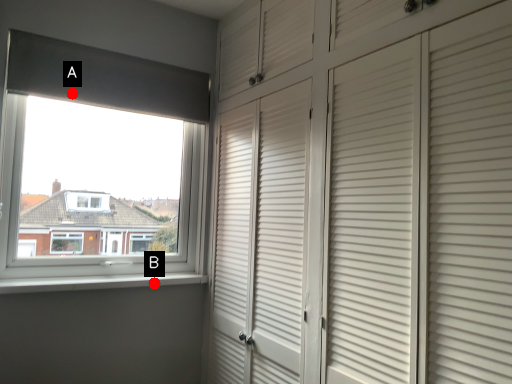
Question: Two points are circled on the image, labeled by A and B beside each circle. Which of the following is the farthest from the observer?

Choices:
 (A) A is further
 (B) B is further

Answer: (B)